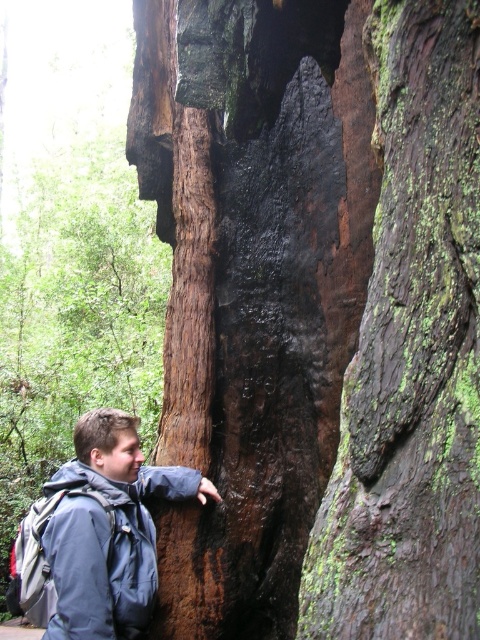
Question: Can you confirm if green mossy bark at center is wider than blue fabric jacket at left?

Choices:
 (A) yes
 (B) no

Answer: (B)

Question: Among these objects, which one is farthest from the camera?

Choices:
 (A) green mossy bark at center
 (B) blue fabric jacket at left

Answer: (B)

Question: Which of the following is the closest to the observer?

Choices:
 (A) (415, 67)
 (B) (93, 476)

Answer: (A)

Question: Is green mossy bark at center further to camera compared to blue fabric jacket at left?

Choices:
 (A) yes
 (B) no

Answer: (B)

Question: Does green mossy bark at center appear on the left side of blue fabric jacket at left?

Choices:
 (A) no
 (B) yes

Answer: (A)